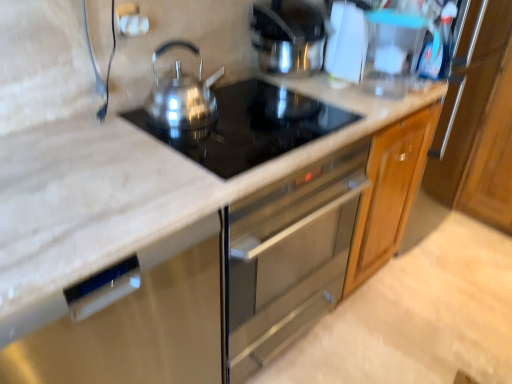
Find the location of a particular element. Image resolution: width=512 pixels, height=384 pixels. blank space above satin silver dishwasher at center (from a real-world perspective) is located at coordinates (78, 178).